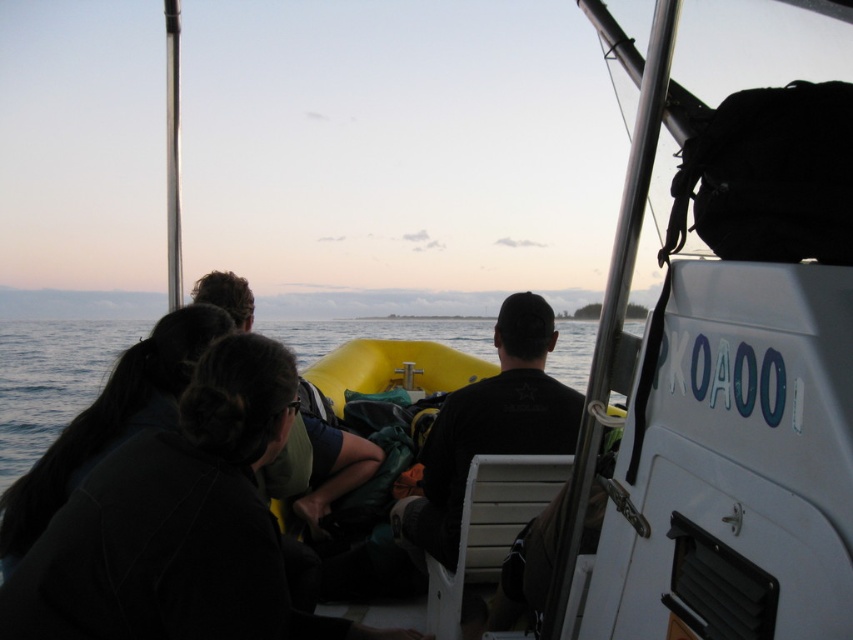
Is blue water at lower left wider than dark green fabric at center?

Yes.

Does blue water at lower left appear over dark green fabric at center?

Yes, blue water at lower left is above dark green fabric at center.

What do you see at coordinates (51, 380) in the screenshot? Image resolution: width=853 pixels, height=640 pixels. I see `blue water at lower left` at bounding box center [51, 380].

Find the location of a particular element. This screenshot has height=640, width=853. blue water at lower left is located at coordinates (51, 380).

Between point (424, 508) and point (352, 440), which one is positioned behind?

The point (352, 440) is more distant.

Measure the distance between black matte shirt at center and dark green fabric at center.

34.92 inches

Between point (506, 324) and point (248, 324), which one is positioned behind?

Point (248, 324)

Identify the location of black matte shirt at center. (488, 428).

Who is higher up, blue water at lower left or black matte shirt at center?

blue water at lower left is higher up.

Can you confirm if blue water at lower left is positioned above black matte shirt at center?

Correct, blue water at lower left is located above black matte shirt at center.

The image size is (853, 640). Describe the element at coordinates (51, 380) in the screenshot. I see `blue water at lower left` at that location.

Where is `blue water at lower left`? The image size is (853, 640). blue water at lower left is located at coordinates tap(51, 380).